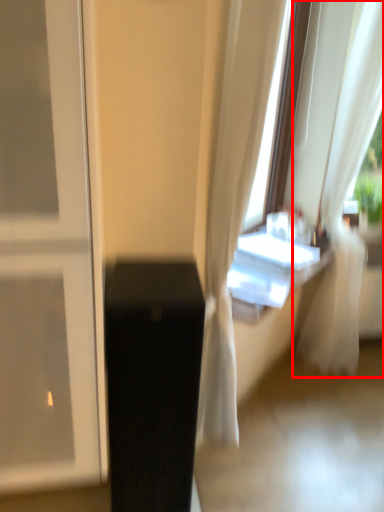
Question: From the image, what is the correct spatial relationship of curtain (annotated by the red box) in relation to furniture?

Choices:
 (A) right
 (B) left

Answer: (A)